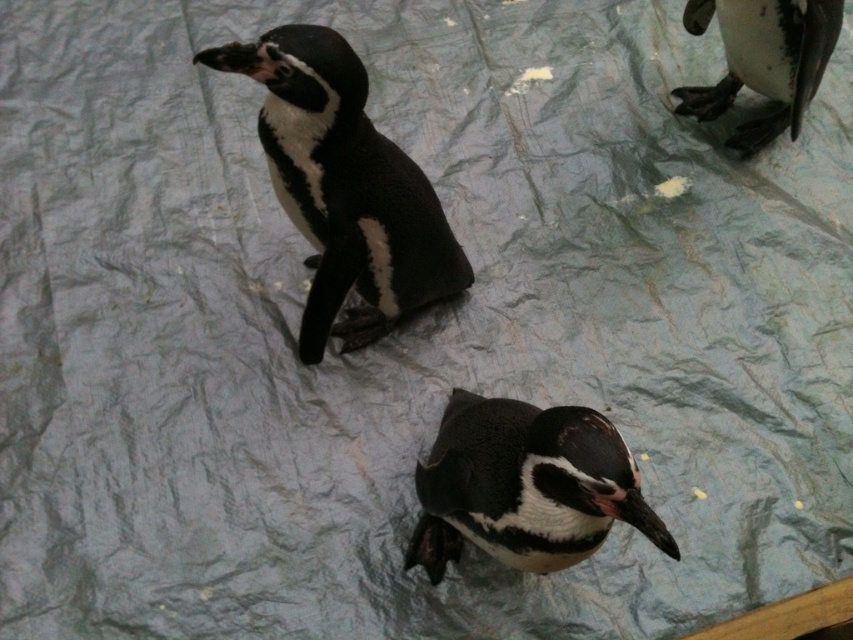
Can you confirm if black matte penguin at upper center is thinner than black glossy penguin at upper right?

No, black matte penguin at upper center is not thinner than black glossy penguin at upper right.

Is point (326, 202) positioned in front of point (799, 113)?

Yes.

The height and width of the screenshot is (640, 853). Identify the location of black matte penguin at upper center. (344, 188).

Who is positioned more to the left, black matte penguin at center or black glossy penguin at upper right?

From the viewer's perspective, black matte penguin at center appears more on the left side.

Does black matte penguin at center appear on the right side of black glossy penguin at upper right?

In fact, black matte penguin at center is to the left of black glossy penguin at upper right.

Identify the location of black matte penguin at center. This screenshot has width=853, height=640. (525, 486).

Image resolution: width=853 pixels, height=640 pixels. In order to click on black matte penguin at center in this screenshot , I will do `click(525, 486)`.

From the picture: Does black matte penguin at upper center have a greater width compared to black matte penguin at center?

Yes.

Who is positioned more to the left, black matte penguin at upper center or black matte penguin at center?

Positioned to the left is black matte penguin at upper center.

Is point (265, 61) farther from viewer compared to point (433, 547)?

No, it is not.

In order to click on black matte penguin at upper center in this screenshot , I will do `click(344, 188)`.